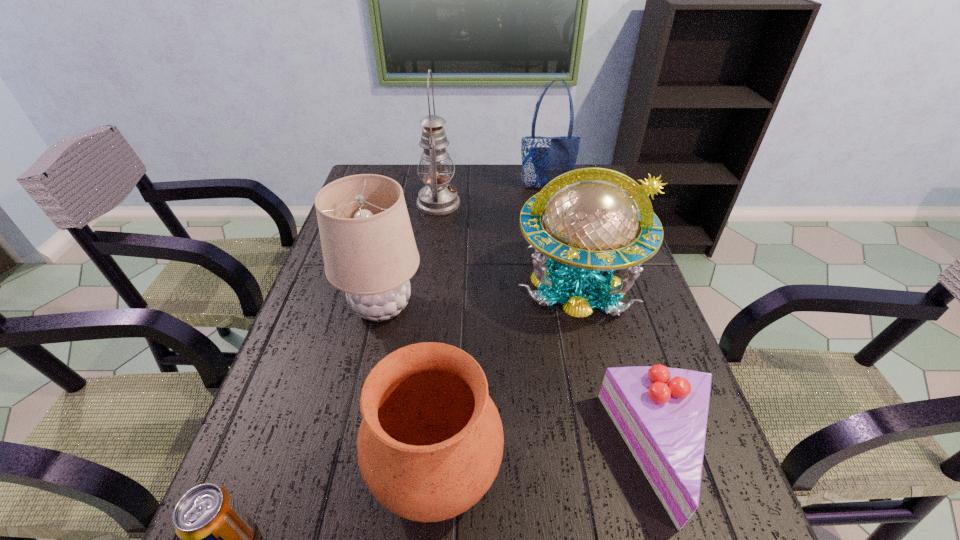
What are the coordinates of `vacant area between the globe and the lampshade` in the screenshot? It's located at (480, 295).

What are the coordinates of `vacant space that's between the oil lamp and the shopping bag` in the screenshot? It's located at (492, 195).

Locate an element on the screen. free space that is in between the oil lamp and the cake is located at coordinates (551, 329).

Find the location of a particular element. The width and height of the screenshot is (960, 540). object that stands as the sixth closest to the cake is located at coordinates (543, 158).

Where is `object that is the fourth closest to the oil lamp`? Image resolution: width=960 pixels, height=540 pixels. object that is the fourth closest to the oil lamp is located at coordinates (430, 444).

The width and height of the screenshot is (960, 540). Find the location of `free spot that satisfies the following two spatial constraints: 1. on the front-facing side of the globe; 2. on the right side of the shopping bag`. free spot that satisfies the following two spatial constraints: 1. on the front-facing side of the globe; 2. on the right side of the shopping bag is located at coordinates (566, 283).